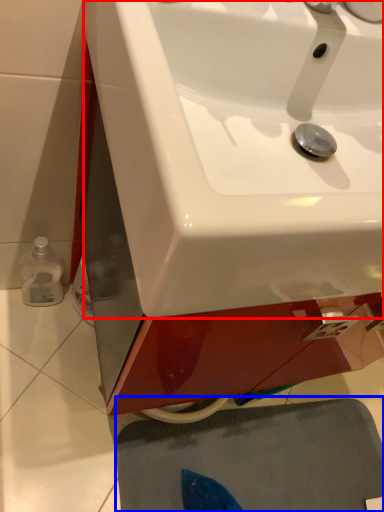
Question: Among these objects, which one is farthest to the camera, sink (highlighted by a red box) or bath mat (highlighted by a blue box)?

Choices:
 (A) sink
 (B) bath mat

Answer: (B)